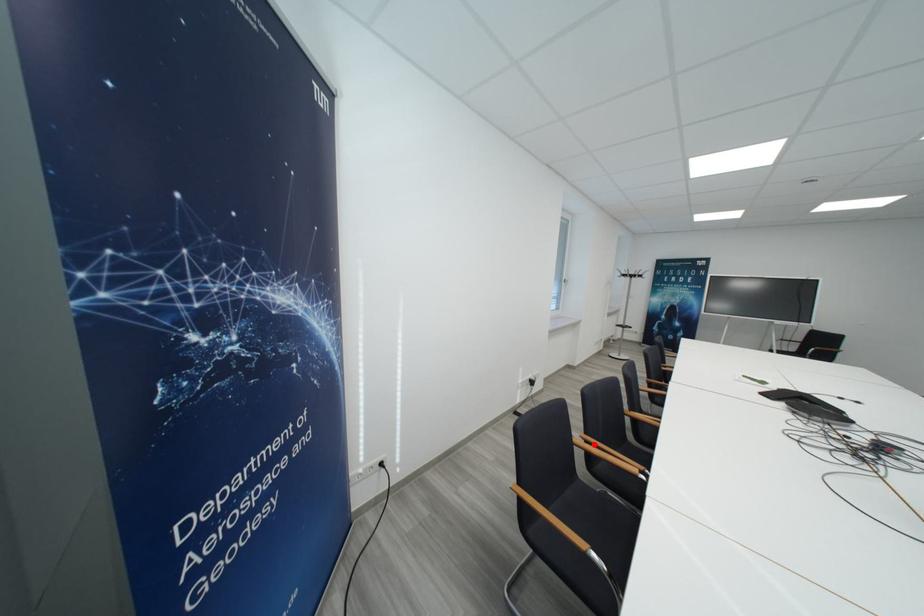
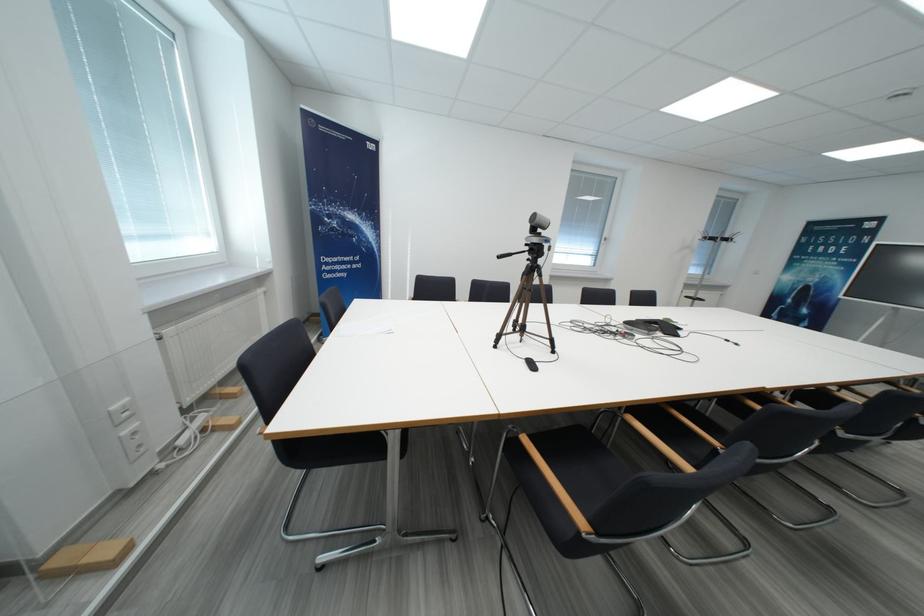
Question: I am providing you with two images of the same scene from different viewpoints. A red point is marked on the first image. Can you still see the location of the red point in image 2?

Choices:
 (A) Yes
 (B) No

Answer: (B)